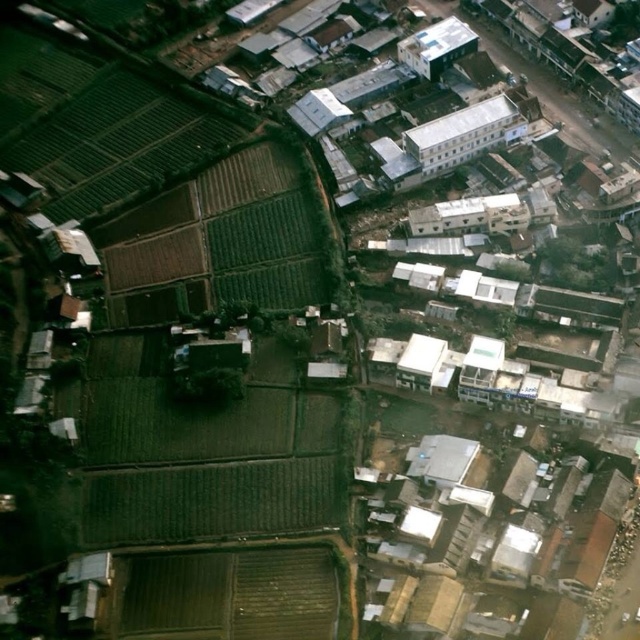
Question: Is white smooth building at center thinner than white matte building at upper center?

Choices:
 (A) yes
 (B) no

Answer: (B)

Question: Does white smooth building at center appear under white matte building at upper center?

Choices:
 (A) yes
 (B) no

Answer: (A)

Question: Which point is farther from the camera taking this photo?

Choices:
 (A) (460, 49)
 (B) (458, 138)

Answer: (A)

Question: Is white smooth building at center bigger than white matte building at upper center?

Choices:
 (A) no
 (B) yes

Answer: (B)

Question: Which object is closer to the camera taking this photo?

Choices:
 (A) white matte building at upper center
 (B) white smooth building at center

Answer: (B)